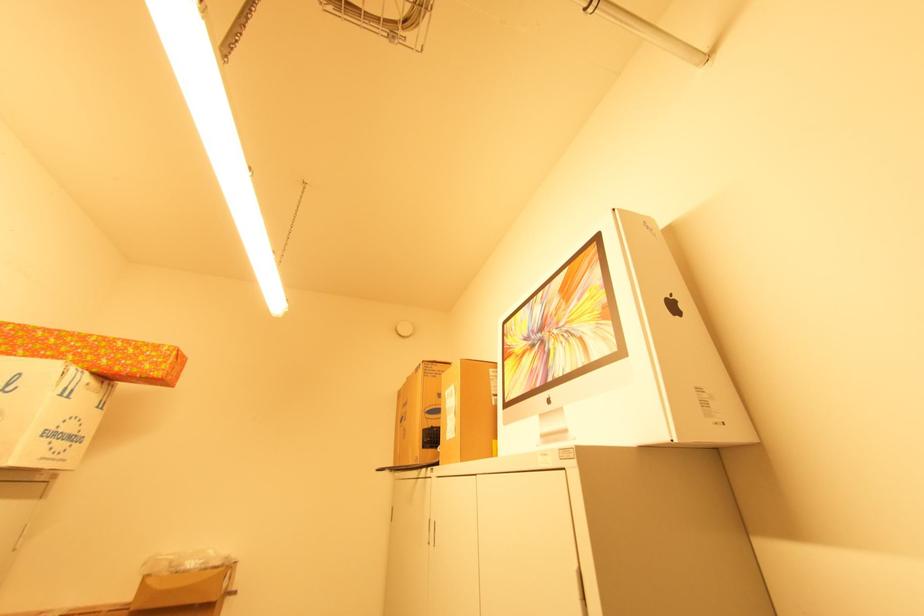
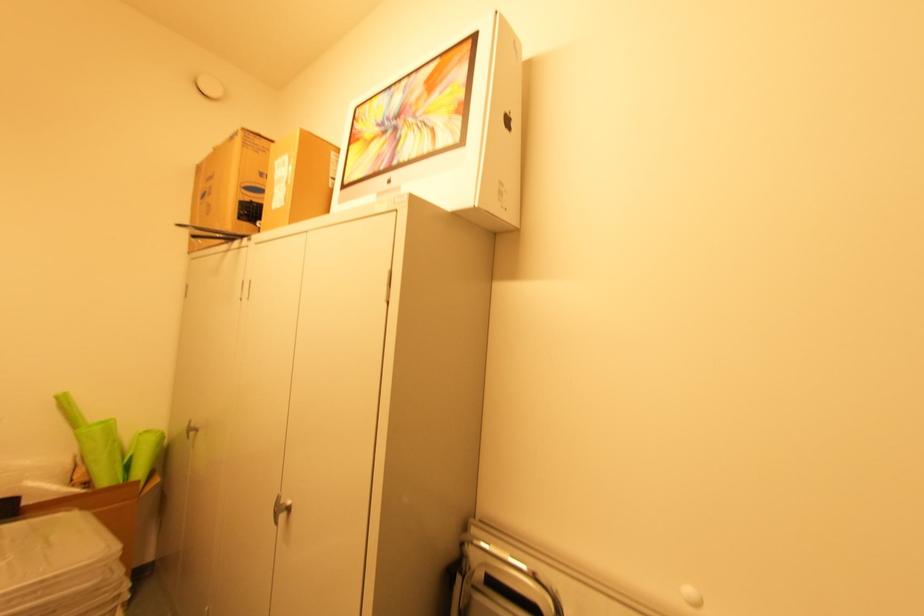
Find the pixel in the second image that matches (x=495, y=398) in the first image.

(334, 180)